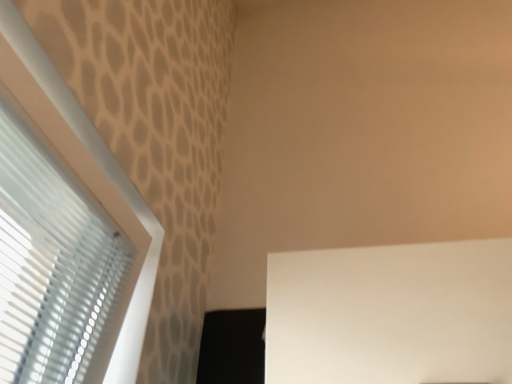
This screenshot has height=384, width=512. Find the location of `white plastic window at left`. white plastic window at left is located at coordinates (110, 186).

What do you see at coordinates (110, 186) in the screenshot? I see `white plastic window at left` at bounding box center [110, 186].

Image resolution: width=512 pixels, height=384 pixels. I want to click on white plastic window at left, so click(110, 186).